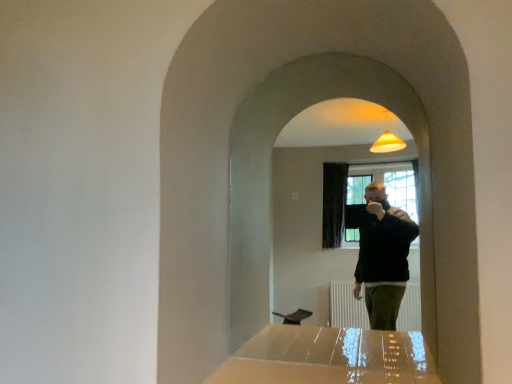
Image resolution: width=512 pixels, height=384 pixels. Describe the element at coordinates (328, 357) in the screenshot. I see `glossy white table at lower center` at that location.

Image resolution: width=512 pixels, height=384 pixels. In order to click on glossy white table at lower center in this screenshot , I will do `click(328, 357)`.

At what (x,y) coordinates should I click in order to perform the action: click on glossy white table at lower center. Please return your answer as a coordinate pair (x, y). The height and width of the screenshot is (384, 512). Looking at the image, I should click on (328, 357).